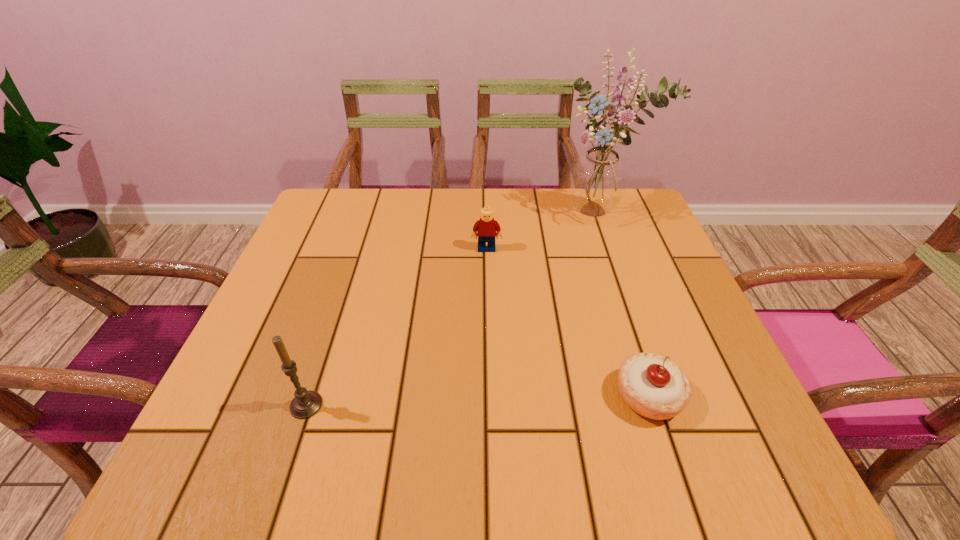
This screenshot has height=540, width=960. Identify the location of bouquet located in the right edge section of the desktop. (597, 181).

The width and height of the screenshot is (960, 540). Find the location of `object located at the near left corner`. object located at the near left corner is located at coordinates (305, 404).

This screenshot has width=960, height=540. Identify the location of object situated at the far right corner. (597, 181).

Where is `object situated at the near right corner`? Image resolution: width=960 pixels, height=540 pixels. object situated at the near right corner is located at coordinates (654, 387).

Locate an element on the screen. The width and height of the screenshot is (960, 540). vacant area at the far edge is located at coordinates (401, 206).

Locate an element on the screen. The height and width of the screenshot is (540, 960). free region at the near edge is located at coordinates (442, 407).

Image resolution: width=960 pixels, height=540 pixels. I want to click on blank space at the left edge of the desktop, so click(x=323, y=348).

This screenshot has width=960, height=540. I want to click on free space at the right edge of the desktop, so click(634, 280).

Locate an element on the screen. free space at the far left corner is located at coordinates (318, 206).

Locate an element on the screen. The width and height of the screenshot is (960, 540). empty location between the bouquet and the shortest object is located at coordinates (625, 303).